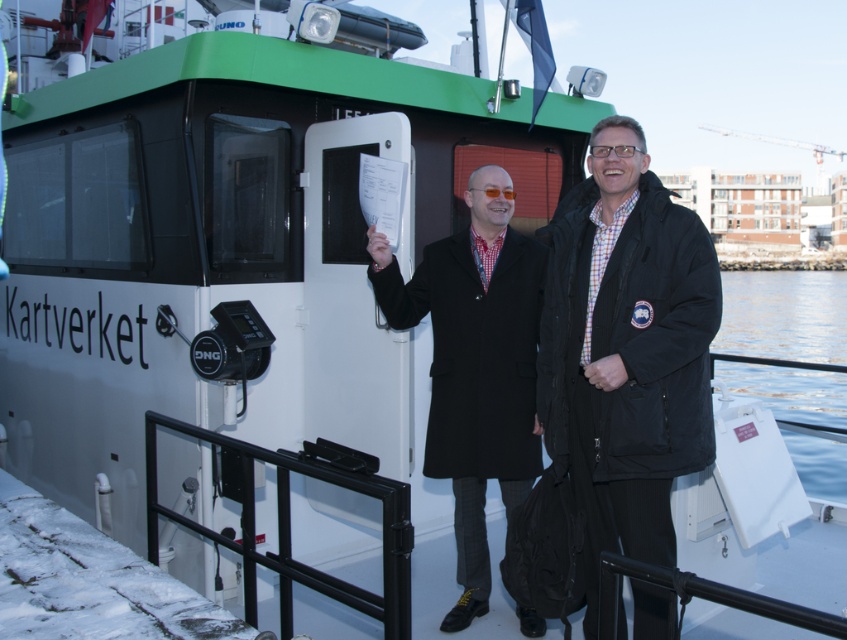
You are a photographer on the boat deck. You need to take a photo of the matte black coat at center and the clear water at lower right. Can you capture both in the same frame without moving your camera?

The matte black coat at center is located below the clear water at lower right, so yes, you can capture both in the same frame without moving your camera since they are vertically aligned.

You are a photographer on the boat deck and need to decide which coat to wear for a photo shoot. The black wool coat at center and the matte black coat at center are available. Which coat is bigger in size and thus more suitable for a winter photo?

The black wool coat at center is larger in size than the matte black coat at center, making it more suitable for a winter photo.